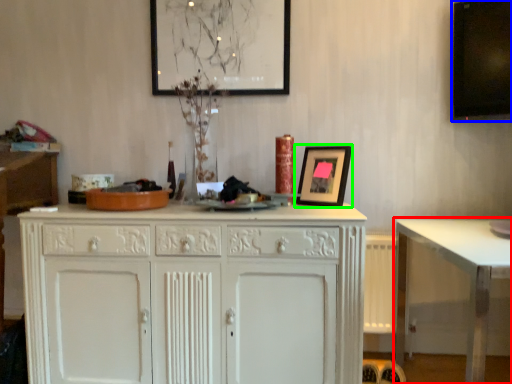
Question: Estimate the real-world distances between objects in this image. Which object is farther from table (highlighted by a red box), computer monitor (highlighted by a blue box) or picture frame (highlighted by a green box)?

Choices:
 (A) computer monitor
 (B) picture frame

Answer: (A)